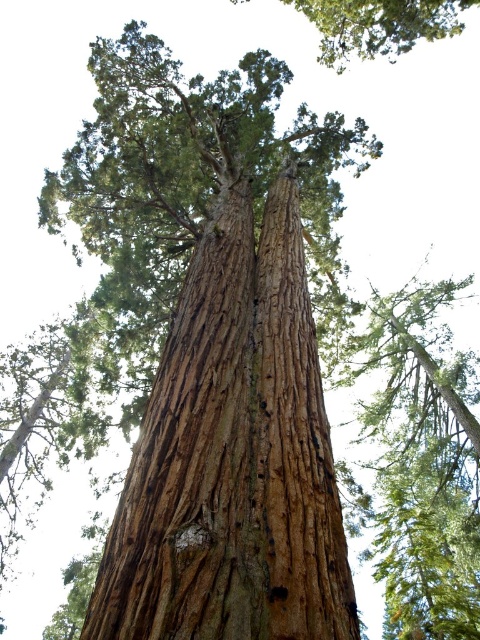
Which of these two, brown rough bark tree at center or brown rough bark tree at upper center, stands shorter?

With less height is brown rough bark tree at center.

Between brown rough bark tree at center and brown rough bark tree at upper center, which one appears on the right side from the viewer's perspective?

brown rough bark tree at upper center is more to the right.

Between point (259, 532) and point (384, 20), which one is positioned in front?

Point (259, 532) is in front.

Image resolution: width=480 pixels, height=640 pixels. In order to click on brown rough bark tree at center in this screenshot , I will do `click(214, 346)`.